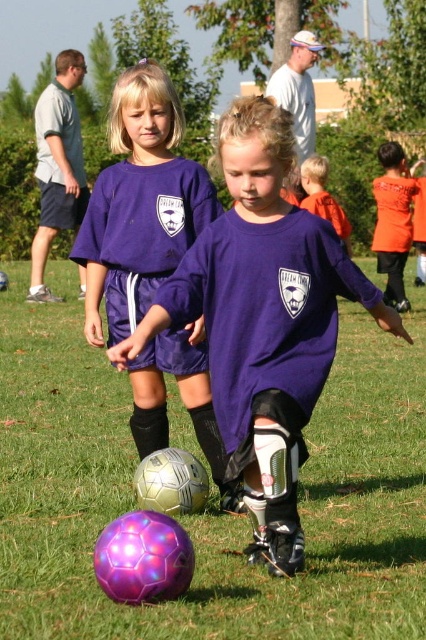
Is purple matte soccer ball at lower left wider than light gray shirt at upper left?

No, purple matte soccer ball at lower left is not wider than light gray shirt at upper left.

In the scene shown: Does purple matte soccer ball at lower left appear on the right side of light gray shirt at upper left?

Correct, you'll find purple matte soccer ball at lower left to the right of light gray shirt at upper left.

Does point (250, 300) lie behind point (37, 296)?

No, it is in front of (37, 296).

I want to click on purple matte soccer ball at lower left, so click(x=262, y=321).

Between green grass at center and orange fabric shirt at upper right, which one is positioned higher?

orange fabric shirt at upper right is higher up.

Locate an element on the screen. This screenshot has height=640, width=426. green grass at center is located at coordinates (212, 492).

The height and width of the screenshot is (640, 426). I want to click on green grass at center, so click(212, 492).

Does green grass at center have a smaller size compared to light gray shirt at upper left?

Correct, green grass at center occupies less space than light gray shirt at upper left.

Is point (158, 625) more distant than point (34, 250)?

No, (158, 625) is in front of (34, 250).

Find the location of `green grass at center`. green grass at center is located at coordinates (212, 492).